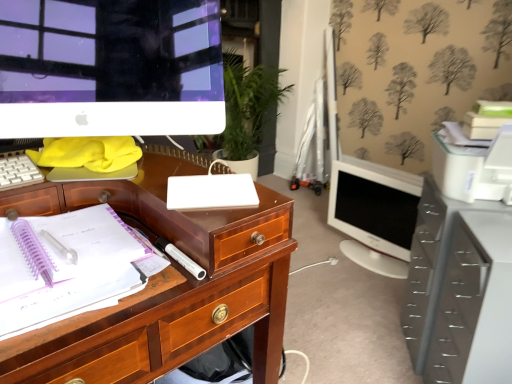
Question: Can you confirm if translucent plastic pen at left, the first office supplies in the bottom-to-top sequence, is wider than white glossy computer monitor at upper left, which ranks as the second computer monitor in right-to-left order?

Choices:
 (A) no
 (B) yes

Answer: (B)

Question: Is translucent plastic pen at left, the first office supplies in the bottom-to-top sequence, smaller than white glossy computer monitor at upper left, the 2th computer monitor when ordered from back to front?

Choices:
 (A) yes
 (B) no

Answer: (A)

Question: From a real-world perspective, is translucent plastic pen at left, marked as the 1th office supplies in a left-to-right arrangement, physically below white glossy computer monitor at upper left, the 1th computer monitor positioned from the front?

Choices:
 (A) no
 (B) yes

Answer: (B)

Question: Does translucent plastic pen at left, the first office supplies in the bottom-to-top sequence, come behind white glossy computer monitor at upper left, the 1th computer monitor positioned from the front?

Choices:
 (A) yes
 (B) no

Answer: (B)

Question: Does translucent plastic pen at left, which ranks as the 2th office supplies in top-to-bottom order, appear on the right side of white glossy computer monitor at upper left, the 1th computer monitor positioned from the left?

Choices:
 (A) yes
 (B) no

Answer: (B)

Question: Is translucent plastic pen at left, which ranks as the 2th office supplies in top-to-bottom order, far away from white glossy computer monitor at upper left, the 1th computer monitor positioned from the left?

Choices:
 (A) yes
 (B) no

Answer: (B)

Question: From a real-world perspective, is metallic gray file cabinet at lower right located higher than white plastic keyboard at left?

Choices:
 (A) yes
 (B) no

Answer: (B)

Question: Can you confirm if metallic gray file cabinet at lower right is taller than white plastic keyboard at left?

Choices:
 (A) yes
 (B) no

Answer: (A)

Question: From the image's perspective, would you say metallic gray file cabinet at lower right is positioned over white plastic keyboard at left?

Choices:
 (A) yes
 (B) no

Answer: (B)

Question: Is metallic gray file cabinet at lower right outside white plastic keyboard at left?

Choices:
 (A) yes
 (B) no

Answer: (A)

Question: From the image's perspective, is metallic gray file cabinet at lower right beneath white plastic keyboard at left?

Choices:
 (A) no
 (B) yes

Answer: (B)

Question: Considering the relative sizes of metallic gray file cabinet at lower right and white plastic keyboard at left in the image provided, is metallic gray file cabinet at lower right smaller than white plastic keyboard at left?

Choices:
 (A) no
 (B) yes

Answer: (A)

Question: Is translucent plastic pen at left, the first office supplies in the bottom-to-top sequence, not near white glossy monitor at center right, the 1th computer monitor from the back?

Choices:
 (A) no
 (B) yes

Answer: (B)